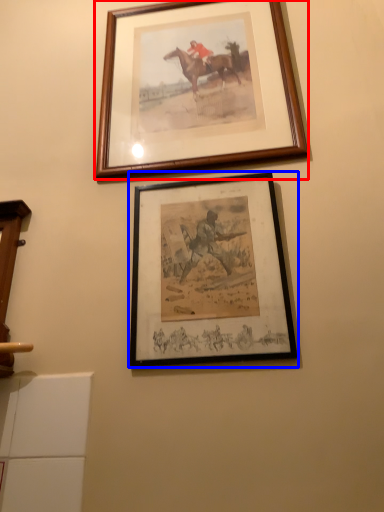
Question: Which object is further to the camera taking this photo, picture frame (highlighted by a red box) or picture frame (highlighted by a blue box)?

Choices:
 (A) picture frame
 (B) picture frame

Answer: (A)